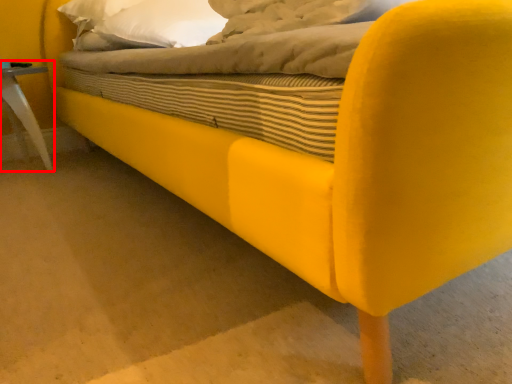
Question: From the image's perspective, where is furniture (annotated by the red box) located relative to pillow?

Choices:
 (A) above
 (B) below

Answer: (B)